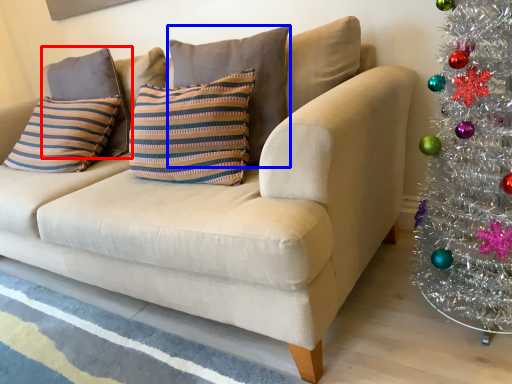
Question: Which point is closer to the camera, pillow (highlighted by a red box) or pillow (highlighted by a blue box)?

Choices:
 (A) pillow
 (B) pillow

Answer: (B)